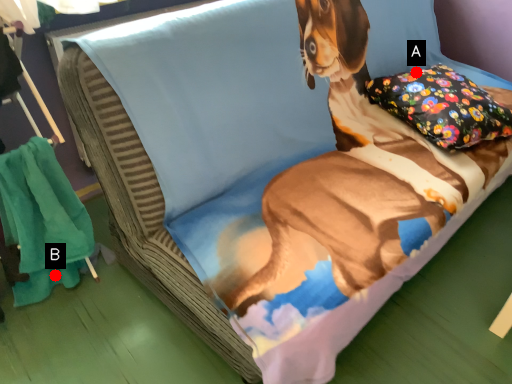
Question: Two points are circled on the image, labeled by A and B beside each circle. Which point is farther from the camera taking this photo?

Choices:
 (A) A is further
 (B) B is further

Answer: (A)